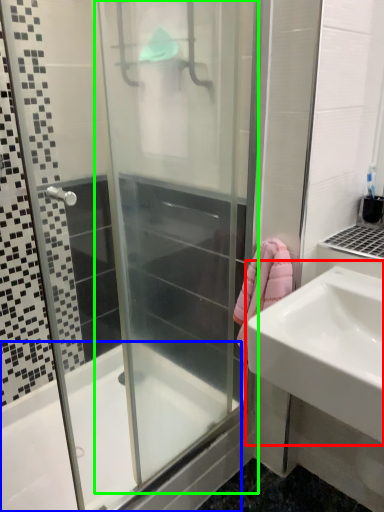
Question: Which object is positioned farthest from sink (highlighted by a red box)? Select from bathtub (highlighted by a blue box) and screen door (highlighted by a green box).

Choices:
 (A) bathtub
 (B) screen door

Answer: (A)